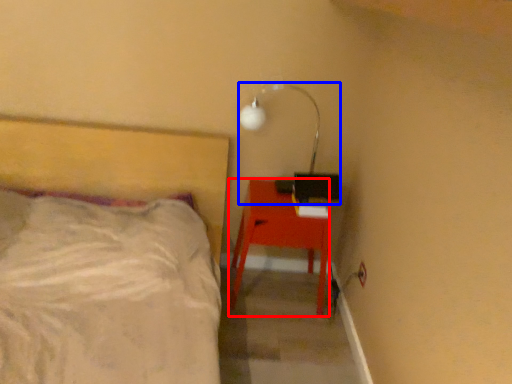
Question: Which of the following is the closest to the observer, desk (highlighted by a red box) or lamp (highlighted by a blue box)?

Choices:
 (A) desk
 (B) lamp

Answer: (B)